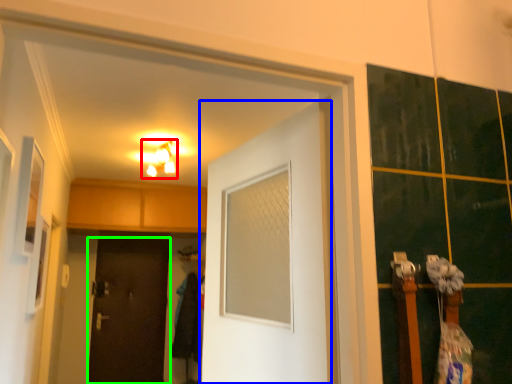
Question: Which is nearer to the light fixture (highlighted by a red box)? door (highlighted by a blue box) or door (highlighted by a green box).

Choices:
 (A) door
 (B) door

Answer: (B)